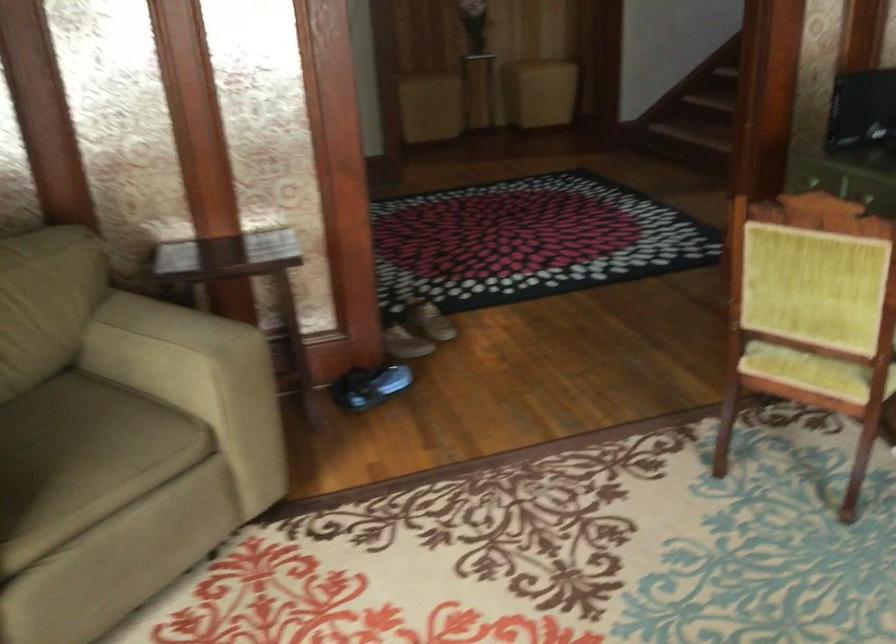
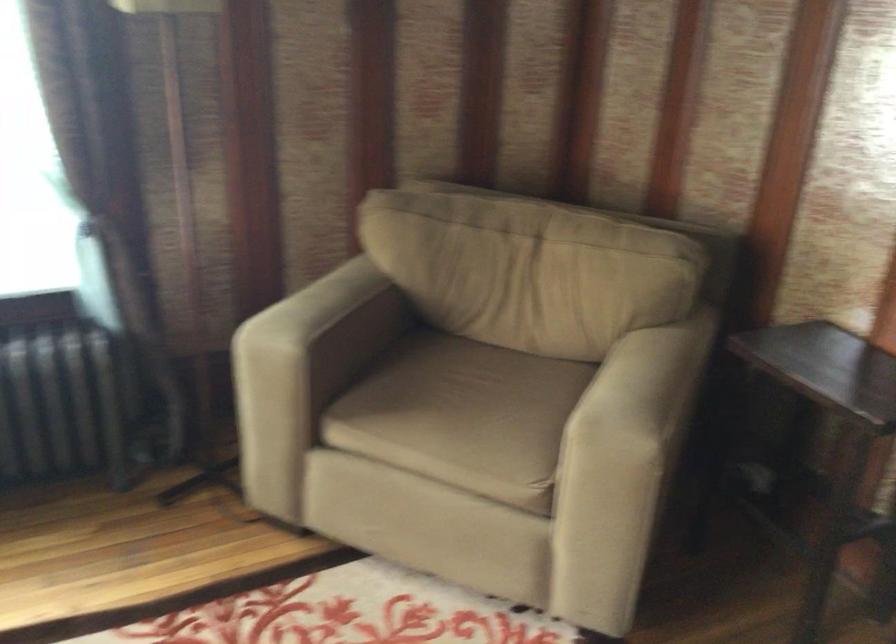
Find the pixel in the second image that matches (231,257) in the first image.

(826, 368)